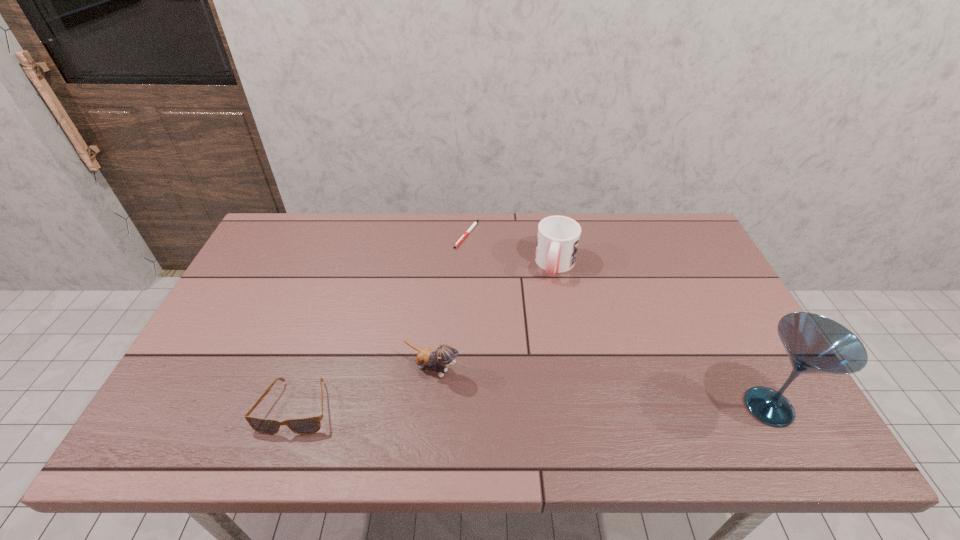
Image resolution: width=960 pixels, height=540 pixels. Identify the location of free space located on the side of the second object from right to left with the handle. (532, 362).

Image resolution: width=960 pixels, height=540 pixels. In order to click on free spot located on the clicker of the pen in this screenshot , I will do `click(470, 281)`.

Find the location of a particular element. vacant space located on the clicker of the pen is located at coordinates (468, 259).

The image size is (960, 540). Find the location of `vacant space located 0.140m on the clicker of the pen`. vacant space located 0.140m on the clicker of the pen is located at coordinates (470, 279).

The image size is (960, 540). What are the coordinates of `vacant space located 0.130m on the front-facing side of the third tallest object` in the screenshot? It's located at (502, 401).

Locate an element on the screen. vacant space located 0.050m on the front-facing side of the third tallest object is located at coordinates (473, 386).

Where is `vacant region located on the front-facing side of the third tallest object`? vacant region located on the front-facing side of the third tallest object is located at coordinates (477, 388).

This screenshot has width=960, height=540. In order to click on mug that is at the far edge in this screenshot , I will do `click(558, 237)`.

Locate an element on the screen. The height and width of the screenshot is (540, 960). pen that is at the far edge is located at coordinates (460, 240).

Image resolution: width=960 pixels, height=540 pixels. In order to click on sunglasses present at the near edge in this screenshot , I will do (309, 425).